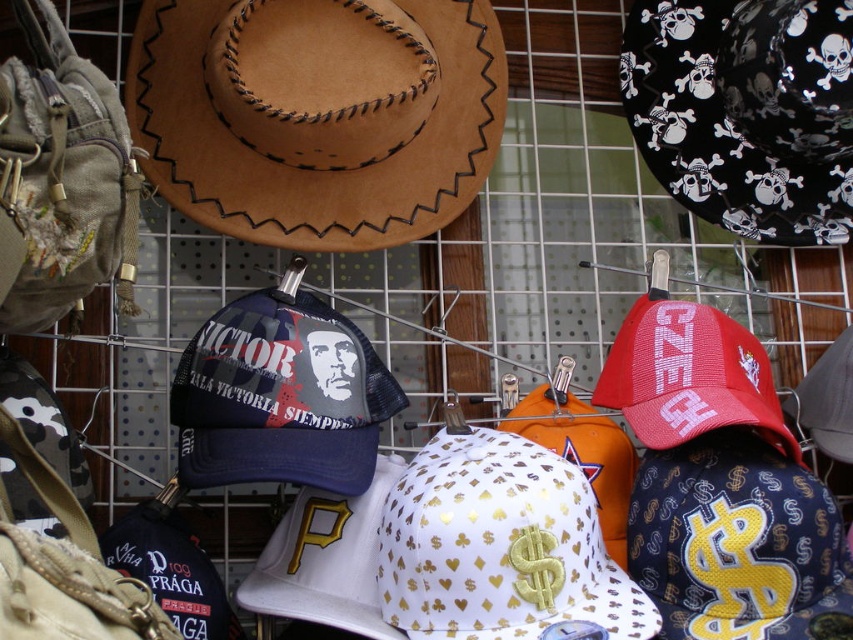
Does brown suede cowboy hat at upper left have a lesser width compared to gold metallic baseball cap at center?

In fact, brown suede cowboy hat at upper left might be wider than gold metallic baseball cap at center.

What do you see at coordinates (317, 115) in the screenshot? I see `brown suede cowboy hat at upper left` at bounding box center [317, 115].

What are the coordinates of `brown suede cowboy hat at upper left` in the screenshot? It's located at (317, 115).

Looking at this image, measure the distance between point [206,49] and camera.

The distance of point [206,49] from camera is 4.45 feet.

Which is more to the left, brown suede cowboy hat at upper left or black matte cowboy hat at upper right?

Answer: brown suede cowboy hat at upper left is more to the left.

The height and width of the screenshot is (640, 853). Find the location of `brown suede cowboy hat at upper left`. brown suede cowboy hat at upper left is located at coordinates (317, 115).

Where is `brown suede cowboy hat at upper left`? The height and width of the screenshot is (640, 853). brown suede cowboy hat at upper left is located at coordinates (317, 115).

Which is more to the left, black matte cowboy hat at upper right or gold metallic baseball cap at center?

From the viewer's perspective, gold metallic baseball cap at center appears more on the left side.

Looking at this image, can you confirm if black matte cowboy hat at upper right is positioned below gold metallic baseball cap at center?

Actually, black matte cowboy hat at upper right is above gold metallic baseball cap at center.

The width and height of the screenshot is (853, 640). In order to click on black matte cowboy hat at upper right in this screenshot , I will do `click(746, 112)`.